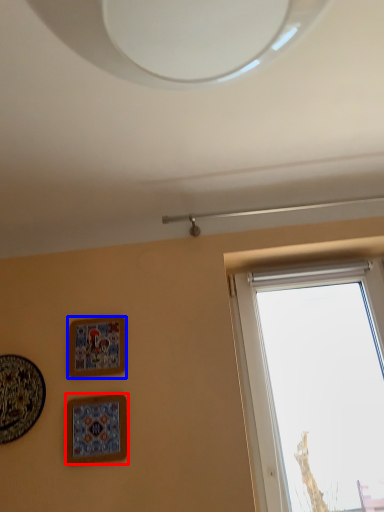
Question: Which of the following is the farthest to the observer, picture frame (highlighted by a red box) or picture frame (highlighted by a blue box)?

Choices:
 (A) picture frame
 (B) picture frame

Answer: (B)